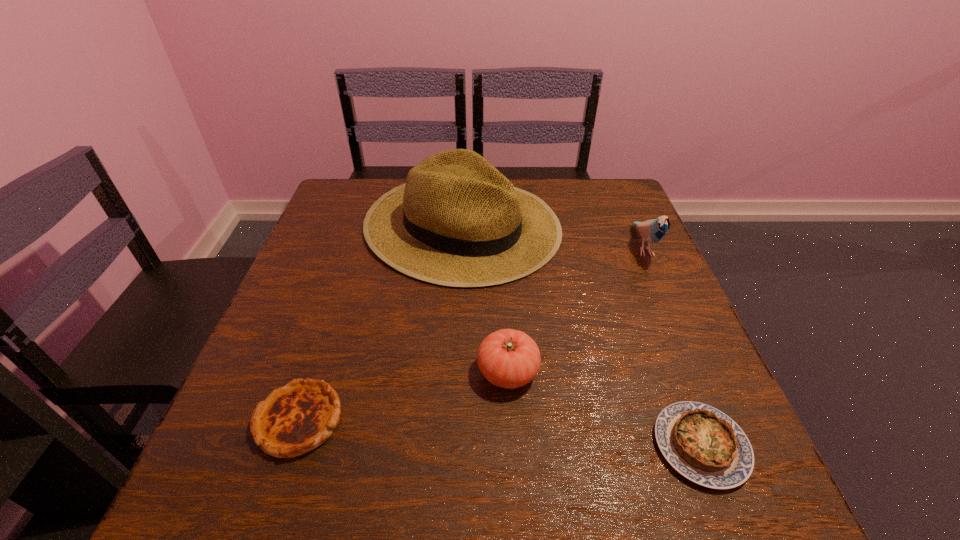
The height and width of the screenshot is (540, 960). Find the location of `unoccupied area between the sunhat and the left quiche`. unoccupied area between the sunhat and the left quiche is located at coordinates (380, 323).

The height and width of the screenshot is (540, 960). What are the coordinates of `free space between the right quiche and the tallest object` in the screenshot? It's located at (582, 335).

I want to click on free space between the left quiche and the sunhat, so click(380, 323).

At what (x,y) coordinates should I click in order to perform the action: click on vacant area between the tallest object and the left quiche. Please return your answer as a coordinate pair (x, y). Looking at the image, I should click on (380, 323).

What are the coordinates of `free space between the left quiche and the right quiche` in the screenshot? It's located at (500, 433).

Where is `object that ranks as the third closest to the left quiche`? object that ranks as the third closest to the left quiche is located at coordinates (703, 444).

Locate which object ranks second in proximity to the right quiche. Please provide its 2D coordinates. Your answer should be formatted as a tuple, i.e. [(x, y)], where the tuple contains the x and y coordinates of a point satisfying the conditions above.

[(457, 221)]

You are a GUI agent. You are given a task and a screenshot of the screen. Output one action in this format:
    pyautogui.click(x=<x>, y=<y>)
    Task: Click on the vacant position in the image that satisfies the following two spatial constraints: 1. on the front side of the right quiche; 2. on the left side of the tomato
    Image resolution: width=960 pixels, height=540 pixels.
    Given the screenshot: What is the action you would take?
    pyautogui.click(x=512, y=446)

This screenshot has height=540, width=960. I want to click on vacant area that satisfies the following two spatial constraints: 1. on the front side of the sunhat; 2. on the left side of the right quiche, so click(x=451, y=446).